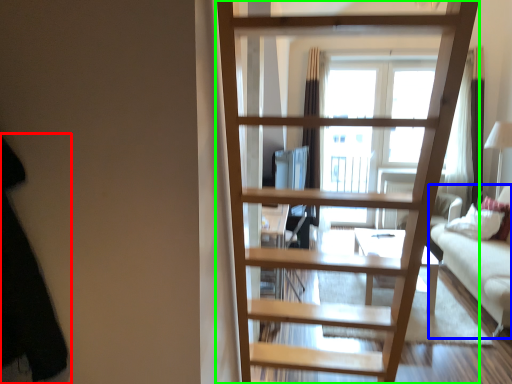
Question: Based on their relative distances, which object is nearer to dark (highlighted by a red box)? Choose from studio couch (highlighted by a blue box) and ladder (highlighted by a green box).

Choices:
 (A) studio couch
 (B) ladder

Answer: (B)